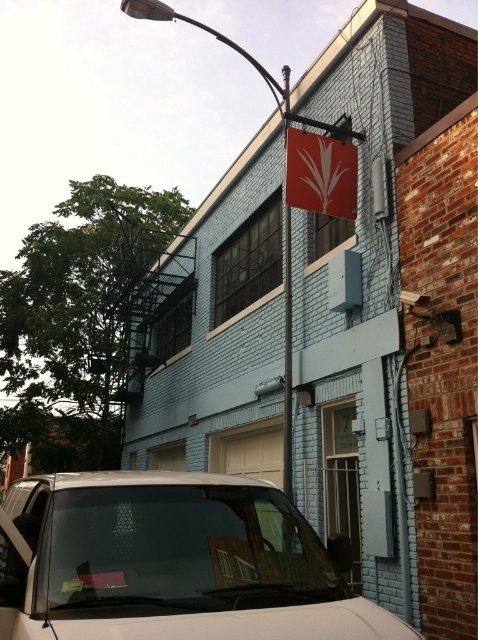
Is white matte car at lower left bigger than red matte sign at upper center?

Yes.

Can you confirm if white matte car at lower left is positioned to the right of red matte sign at upper center?

In fact, white matte car at lower left is to the left of red matte sign at upper center.

Is point (130, 481) positioned after point (286, 186)?

No, it is in front of (286, 186).

Locate an element on the screen. This screenshot has height=640, width=478. white matte car at lower left is located at coordinates (173, 563).